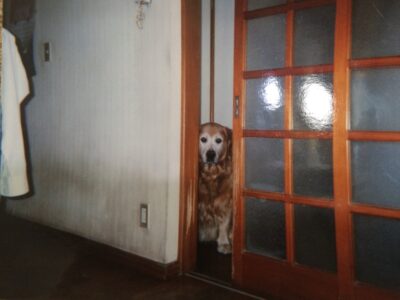
Find the location of a particular element. This screenshot has width=400, height=300. wood sliding door is located at coordinates (237, 122), (341, 128).